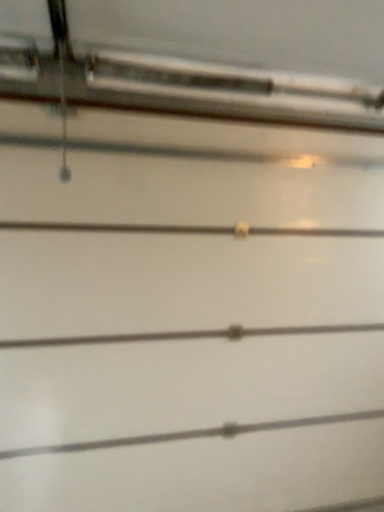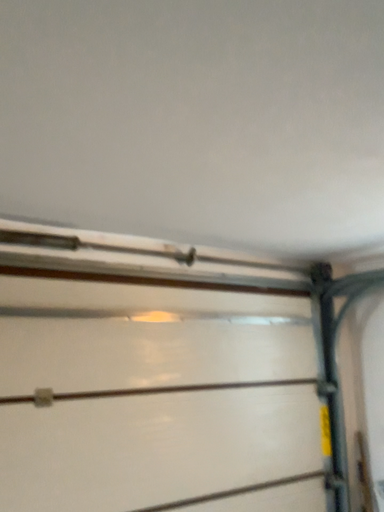
Question: How did the camera likely rotate when shooting the video?

Choices:
 (A) rotated upward
 (B) rotated downward

Answer: (A)